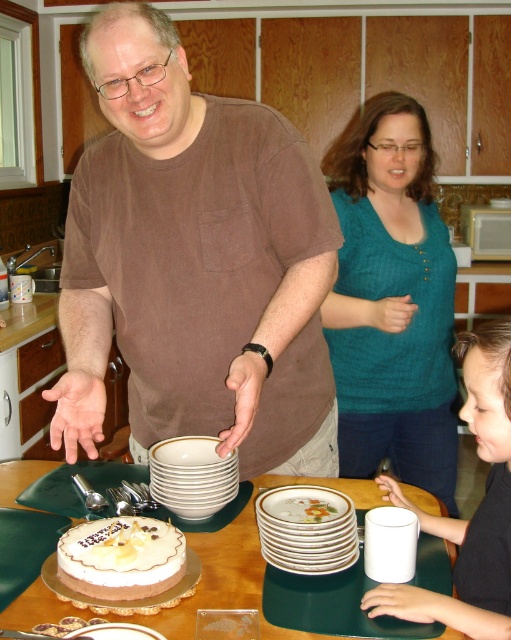
Question: Is brown cotton shirt at center to the right of teal knit shirt at center from the viewer's perspective?

Choices:
 (A) yes
 (B) no

Answer: (B)

Question: Which is nearer to the white frosted cake at center?

Choices:
 (A) brown cotton shirt at center
 (B) black matte cup at lower right
 (C) porcelain plates at center
 (D) teal knit shirt at center

Answer: (C)

Question: Which point appears closest to the camera in this image?

Choices:
 (A) (271, 225)
 (B) (375, 230)

Answer: (A)

Question: Is black matte cup at lower right to the right of porcelain plates at center from the viewer's perspective?

Choices:
 (A) no
 (B) yes

Answer: (B)

Question: Is white glossy plates at center to the left of porcelain plates at center from the viewer's perspective?

Choices:
 (A) no
 (B) yes

Answer: (B)

Question: Which point is closer to the camera taking this photo?

Choices:
 (A) (429, 618)
 (B) (351, 529)

Answer: (A)